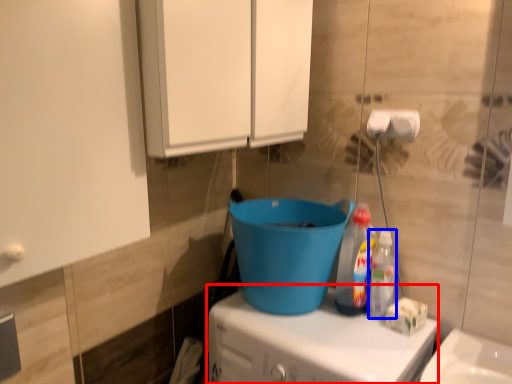
Question: Which object is further to the camera taking this photo, appliance (highlighted by a red box) or bottle (highlighted by a blue box)?

Choices:
 (A) appliance
 (B) bottle

Answer: (B)